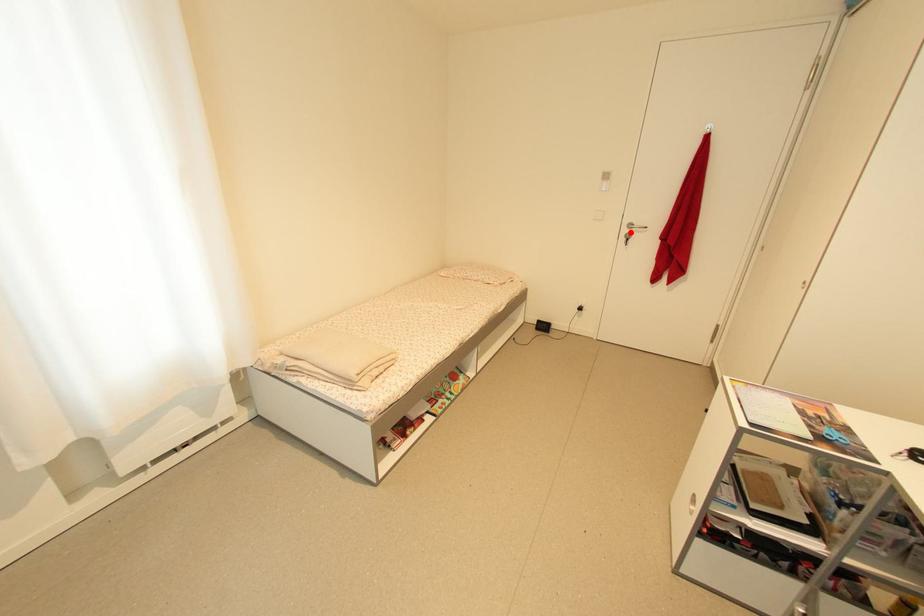
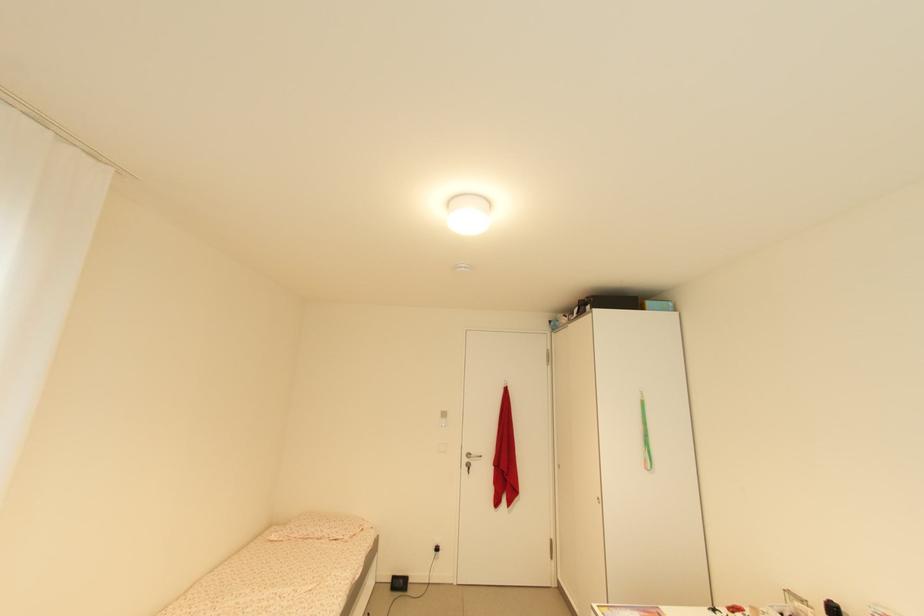
Locate, in the second image, the point that corresponds to the highlighted location in the first image.

(470, 461)